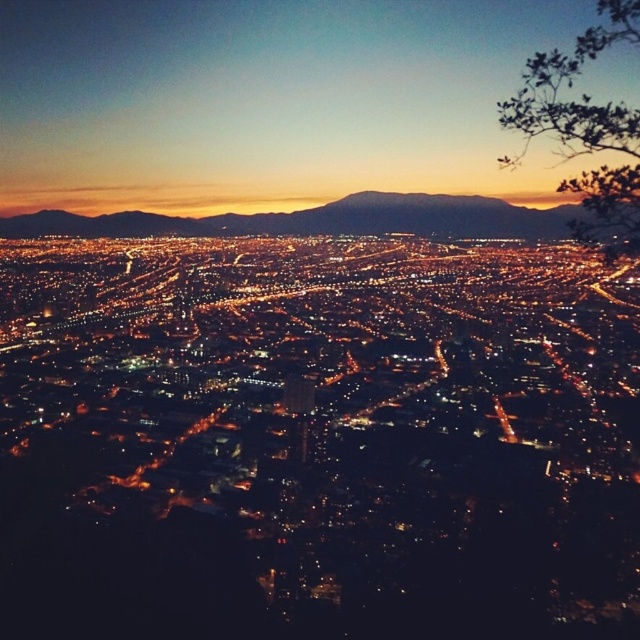
You are an astronomer observing the city skyline from a high vantage point. You notice a specific point in the image at coordinates point [269,100]. What color is the sky at that location?

The sky at point [269,100] is matte orange.

You are an architect observing the cityscape. You notice the matte orange sky at upper center and the dark brown mountain at center. Which object appears closer to you in the scene?

The matte orange sky at upper center appears closer to you because it is further to the viewer than the dark brown mountain at center.

You are an urban planner analyzing the cityscape. You need to identify the coordinates of the matte orange sky at upper center in the image. What are its coordinates?

The coordinates of the matte orange sky at upper center are at point (269,100).